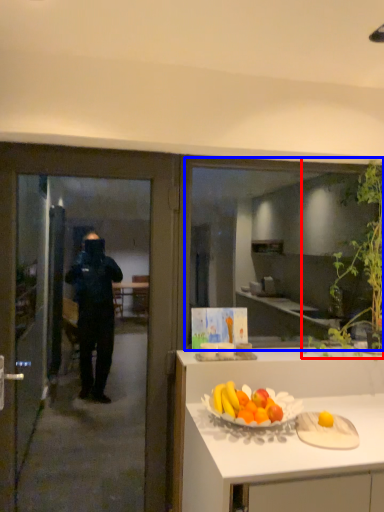
Question: Which point is closer to the camera, plant (highlighted by a red box) or window (highlighted by a blue box)?

Choices:
 (A) plant
 (B) window

Answer: (A)